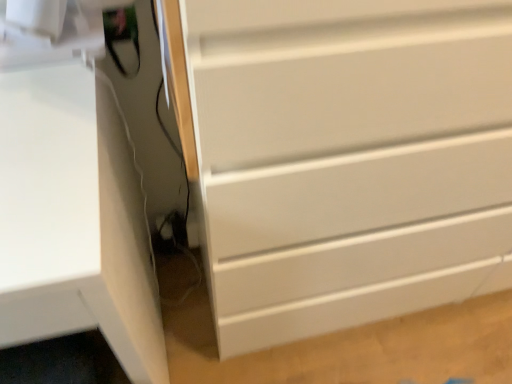
Measure the distance between point (494,31) and camera.

The depth of point (494,31) is 19.29 inches.

You are a GUI agent. You are given a task and a screenshot of the screen. Output one action in this format:
    pyautogui.click(x=<x>, y=<y>)
    Task: Click on the white matte chest of drawers at center
    The image size is (512, 384).
    Given the screenshot: What is the action you would take?
    pyautogui.click(x=349, y=159)

Describe the element at coordinates (349, 159) in the screenshot. The width and height of the screenshot is (512, 384). I see `white matte chest of drawers at center` at that location.

In order to face white matte computer desk at left, should I rotate leftwards or rightwards?

To face it directly, rotate left by 28.114 degrees.

Describe the element at coordinates (74, 220) in the screenshot. I see `white matte computer desk at left` at that location.

Locate an element on the screen. This screenshot has height=384, width=512. white matte computer desk at left is located at coordinates (74, 220).

Locate an element on the screen. The height and width of the screenshot is (384, 512). white matte chest of drawers at center is located at coordinates (349, 159).

Does white matte chest of drawers at center appear on the right side of white matte computer desk at left?

Correct, you'll find white matte chest of drawers at center to the right of white matte computer desk at left.

Between white matte chest of drawers at center and white matte computer desk at left, which one is positioned in front?

Positioned in front is white matte computer desk at left.

Is point (293, 153) positioned behind point (155, 363)?

No.

From the image's perspective, is white matte chest of drawers at center located above or below white matte computer desk at left?

white matte chest of drawers at center is above white matte computer desk at left.

From a real-world perspective, does white matte chest of drawers at center stand above white matte computer desk at left?

Yes, from a real-world perspective, white matte chest of drawers at center is over white matte computer desk at left

Which object is wider, white matte chest of drawers at center or white matte computer desk at left?

white matte computer desk at left is wider.

Based on the photo, between white matte chest of drawers at center and white matte computer desk at left, which one has more height?

white matte chest of drawers at center.

Considering the sizes of white matte chest of drawers at center and white matte computer desk at left in the image, is white matte chest of drawers at center bigger or smaller than white matte computer desk at left?

Clearly, white matte chest of drawers at center is larger in size than white matte computer desk at left.

Based on the photo, choose the correct answer: Is white matte chest of drawers at center inside white matte computer desk at left or outside it?

white matte chest of drawers at center exists outside the volume of white matte computer desk at left.

Would you say white matte chest of drawers at center is a long distance from white matte computer desk at left?

That's not correct — white matte chest of drawers at center is a little close to white matte computer desk at left.

Is white matte chest of drawers at center oriented towards white matte computer desk at left?

No, white matte chest of drawers at center is not oriented towards white matte computer desk at left.

Can you tell me how much white matte chest of drawers at center and white matte computer desk at left differ in facing direction?

white matte chest of drawers at center and white matte computer desk at left are facing 1.92 degrees away from each other.

At what (x,y) coordinates should I click in order to perform the action: click on computer desk on the left of white matte chest of drawers at center. Please return your answer as a coordinate pair (x, y). Looking at the image, I should click on point(74,220).

Is white matte computer desk at left to the left or to the right of white matte chest of drawers at center in the image?

Clearly, white matte computer desk at left is on the left of white matte chest of drawers at center in the image.

Between white matte computer desk at left and white matte chest of drawers at center, which one is positioned in front?

white matte computer desk at left.

Does point (34, 243) lie in front of point (256, 128)?

Yes, it is in front of point (256, 128).

From the image's perspective, relative to white matte chest of drawers at center, is white matte computer desk at left above or below?

Clearly, from the image's perspective, white matte computer desk at left is below white matte chest of drawers at center.

From a real-world perspective, is white matte computer desk at left under white matte chest of drawers at center?

Yes, from a real-world perspective, white matte computer desk at left is under white matte chest of drawers at center.

From the picture: Can you confirm if white matte computer desk at left is thinner than white matte chest of drawers at center?

Incorrect, the width of white matte computer desk at left is not less than that of white matte chest of drawers at center.

Does white matte computer desk at left have a greater height compared to white matte chest of drawers at center?

Incorrect, the height of white matte computer desk at left is not larger of that of white matte chest of drawers at center.

Considering the sizes of objects white matte computer desk at left and white matte chest of drawers at center in the image provided, who is smaller, white matte computer desk at left or white matte chest of drawers at center?

white matte computer desk at left is smaller.

Does white matte computer desk at left contain white matte chest of drawers at center?

Actually, white matte chest of drawers at center is outside white matte computer desk at left.

Can you see white matte computer desk at left touching white matte chest of drawers at center?

white matte computer desk at left and white matte chest of drawers at center are not in contact.

Could you tell me if white matte computer desk at left is facing white matte chest of drawers at center?

No, white matte computer desk at left is not oriented towards white matte chest of drawers at center.

How many degrees apart are the facing directions of white matte computer desk at left and white matte chest of drawers at center?

The angle between the facing direction of white matte computer desk at left and the facing direction of white matte chest of drawers at center is 1.92 degrees.

Image resolution: width=512 pixels, height=384 pixels. I want to click on the chest of drawers that is behind the white matte computer desk at left, so click(x=349, y=159).

What are the coordinates of `chest of drawers above the white matte computer desk at left (from a real-world perspective)` in the screenshot? It's located at (349, 159).

Where is `computer desk in front of the white matte chest of drawers at center`? The image size is (512, 384). computer desk in front of the white matte chest of drawers at center is located at coordinates (74, 220).